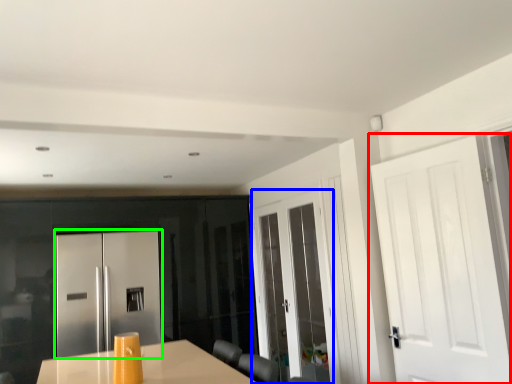
Question: Estimate the real-world distances between objects in this image. Which object is farther from door (highlighted by a red box), door (highlighted by a blue box) or door (highlighted by a green box)?

Choices:
 (A) door
 (B) door

Answer: (B)